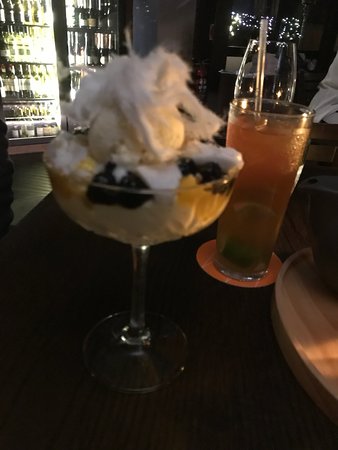
I want to click on wine glass, so click(x=283, y=59).